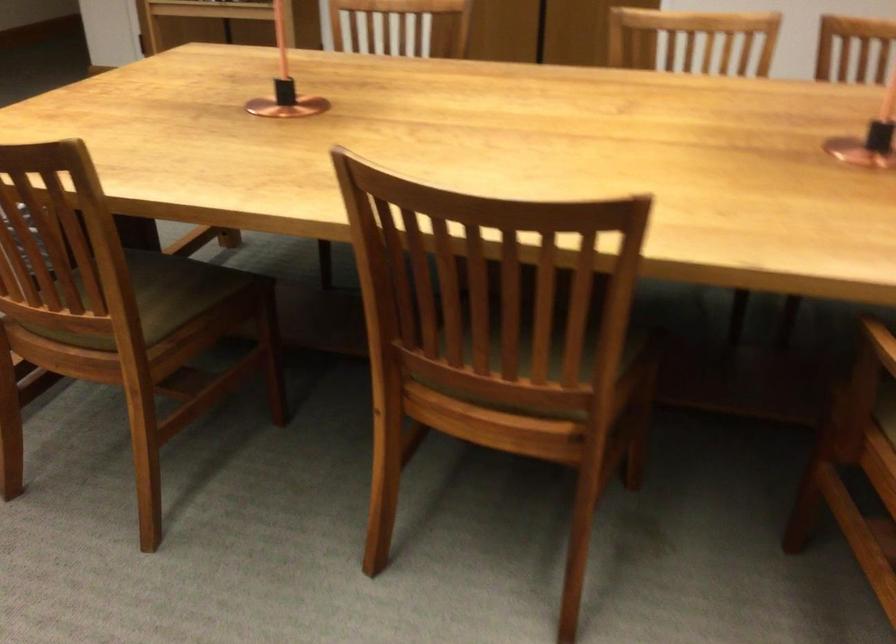
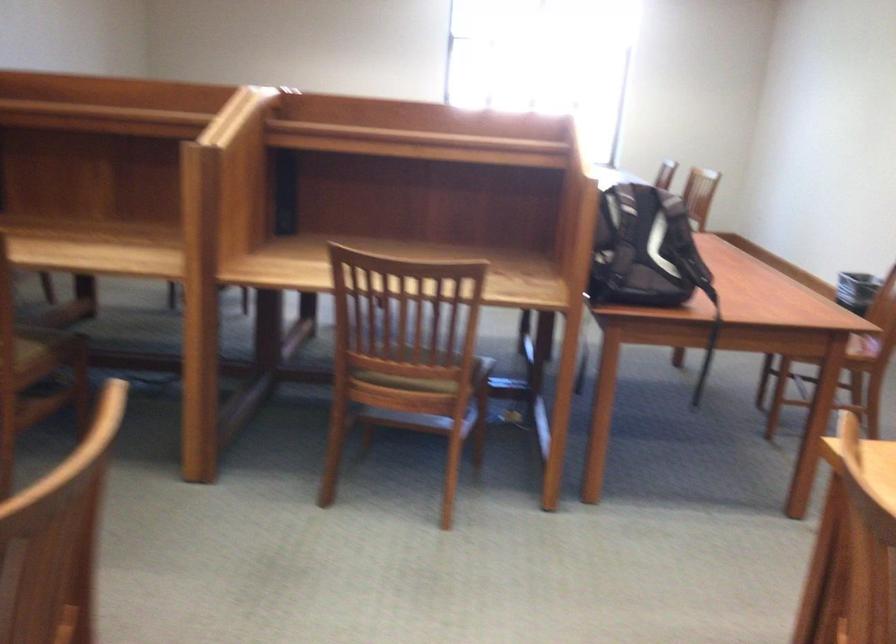
Question: The images are taken continuously from a first-person perspective. In which direction is your viewpoint rotating?

Choices:
 (A) Left
 (B) Right
 (C) Up
 (D) Down

Answer: (A)